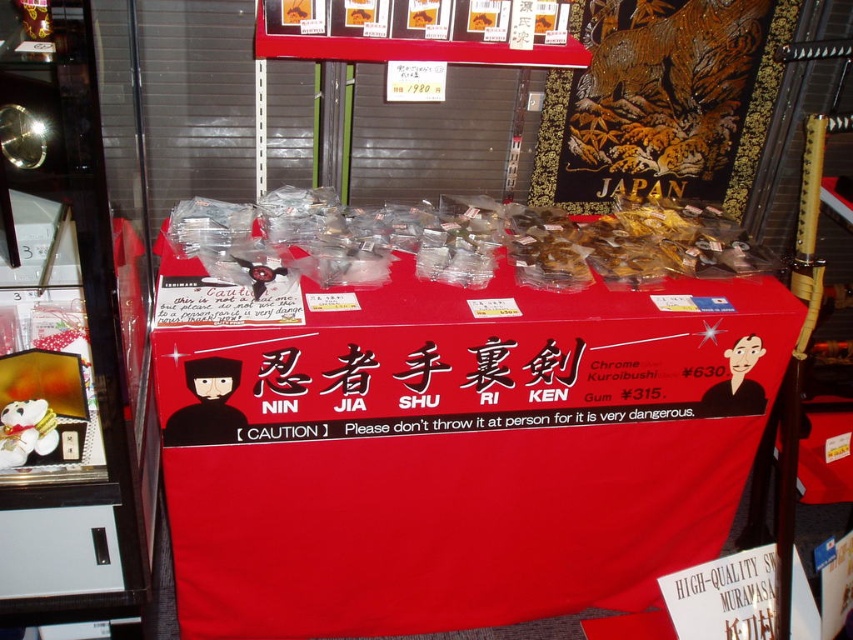
Is red fabric tablecloth at center closer to the viewer compared to black matte ninja at center?

Yes, it is in front of black matte ninja at center.

Who is more forward, (387, 372) or (204, 410)?

Positioned in front is point (204, 410).

Locate an element on the screen. The width and height of the screenshot is (853, 640). red fabric tablecloth at center is located at coordinates (451, 448).

Measure the distance between black matte ninja at center and black matte ninja mask at center.

The distance of black matte ninja at center from black matte ninja mask at center is 37.44 inches.

Looking at this image, who is higher up, black matte ninja at center or black matte ninja mask at center?

Positioned higher is black matte ninja mask at center.

You are a GUI agent. You are given a task and a screenshot of the screen. Output one action in this format:
    pyautogui.click(x=<x>, y=<y>)
    Task: Click on the black matte ninja at center
    The image size is (853, 640).
    Given the screenshot: What is the action you would take?
    pyautogui.click(x=207, y=404)

In the scene shown: Is red fabric tablecloth at center shorter than black matte ninja mask at center?

No, red fabric tablecloth at center is not shorter than black matte ninja mask at center.

Who is higher up, red fabric tablecloth at center or black matte ninja mask at center?

black matte ninja mask at center is above.

What do you see at coordinates (451, 448) in the screenshot? The height and width of the screenshot is (640, 853). I see `red fabric tablecloth at center` at bounding box center [451, 448].

You are a GUI agent. You are given a task and a screenshot of the screen. Output one action in this format:
    pyautogui.click(x=<x>, y=<y>)
    Task: Click on the red fabric tablecloth at center
    
    Given the screenshot: What is the action you would take?
    pyautogui.click(x=451, y=448)